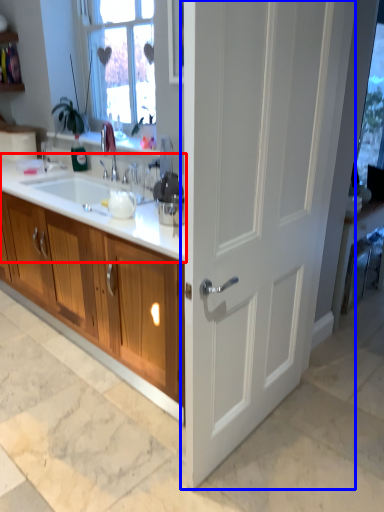
Question: Which of the following is the closest to the observer, countertop (highlighted by a red box) or door (highlighted by a blue box)?

Choices:
 (A) countertop
 (B) door

Answer: (B)